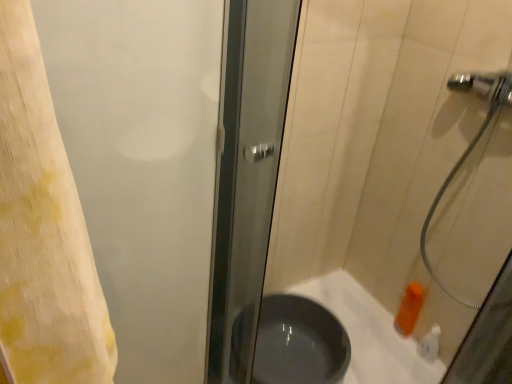
Question: Can you confirm if matte gray bath at lower right is taller than matte black basin at center?

Choices:
 (A) yes
 (B) no

Answer: (A)

Question: Considering the relative sizes of matte gray bath at lower right and matte black basin at center in the image provided, is matte gray bath at lower right smaller than matte black basin at center?

Choices:
 (A) yes
 (B) no

Answer: (B)

Question: Is matte gray bath at lower right to the left of matte black basin at center from the viewer's perspective?

Choices:
 (A) no
 (B) yes

Answer: (A)

Question: Can you confirm if matte gray bath at lower right is bigger than matte black basin at center?

Choices:
 (A) no
 (B) yes

Answer: (B)

Question: Does matte gray bath at lower right contain matte black basin at center?

Choices:
 (A) no
 (B) yes

Answer: (B)

Question: From a real-world perspective, is matte gray bath at lower right physically above matte black basin at center?

Choices:
 (A) no
 (B) yes

Answer: (A)

Question: Would you say matte gray bath at lower right is part of white plastic bottle at lower right's contents?

Choices:
 (A) no
 (B) yes

Answer: (A)

Question: Can you confirm if white plastic bottle at lower right is bigger than matte gray bath at lower right?

Choices:
 (A) no
 (B) yes

Answer: (A)

Question: Can you confirm if white plastic bottle at lower right is thinner than matte gray bath at lower right?

Choices:
 (A) no
 (B) yes

Answer: (B)

Question: Is white plastic bottle at lower right located outside matte gray bath at lower right?

Choices:
 (A) yes
 (B) no

Answer: (A)

Question: Can you confirm if white plastic bottle at lower right is taller than matte gray bath at lower right?

Choices:
 (A) no
 (B) yes

Answer: (A)

Question: Is white plastic bottle at lower right further to camera compared to matte gray bath at lower right?

Choices:
 (A) no
 (B) yes

Answer: (B)

Question: Does frosted glass screen door at left have a lesser height compared to white plastic bottle at lower right?

Choices:
 (A) yes
 (B) no

Answer: (B)